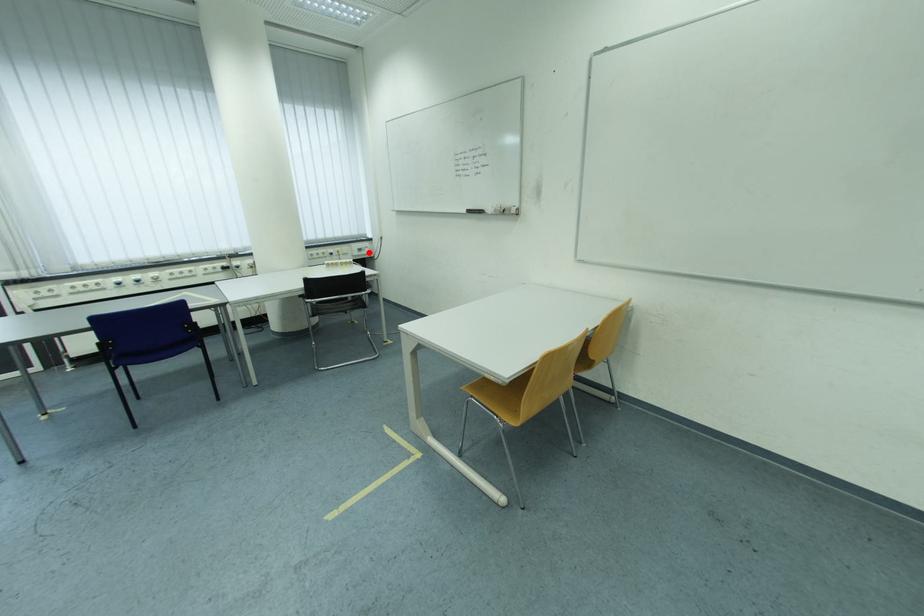
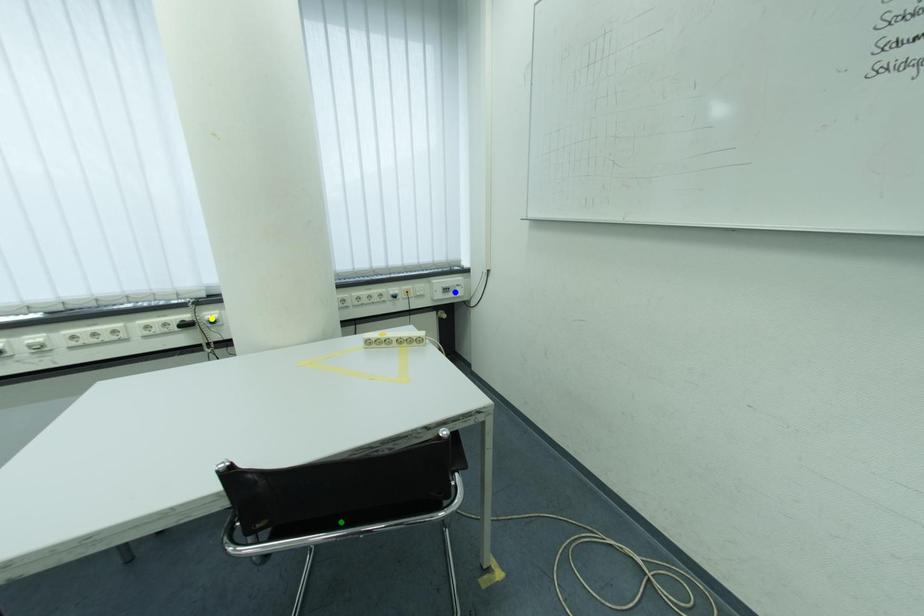
Question: I am providing you with two images of the same scene from different viewpoints. A red point is marked on the first image. You are given multiple points on the second image. Which point in image 2 represents the same 3d spot as the red point in image 1?

Choices:
 (A) blue point
 (B) green point
 (C) yellow point

Answer: (A)